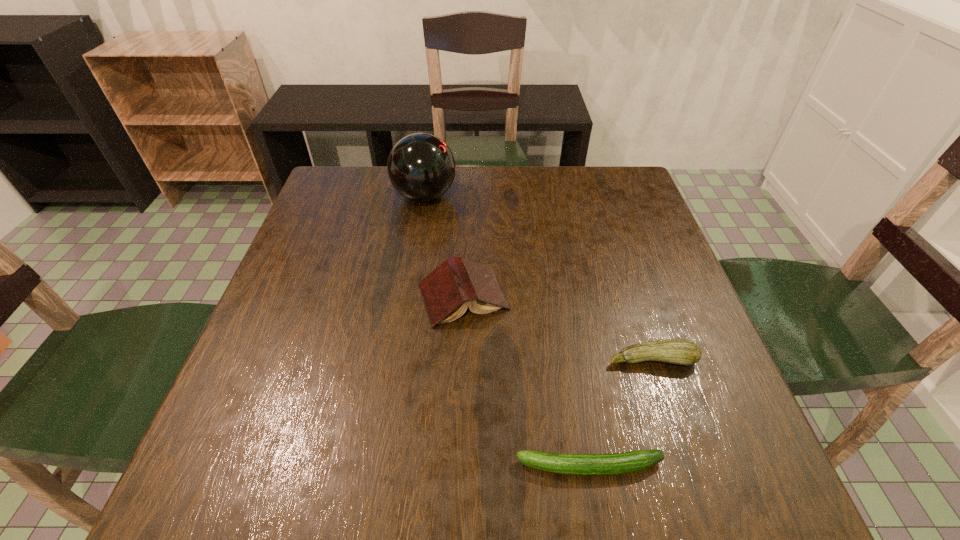
Where is `vacant space located at the stem end of the taller zucchini`? vacant space located at the stem end of the taller zucchini is located at coordinates (670, 414).

Where is `vacant space located 0.110m on the front-facing side of the nearest object`? The height and width of the screenshot is (540, 960). vacant space located 0.110m on the front-facing side of the nearest object is located at coordinates (447, 466).

Locate an element on the screen. free region located 0.250m on the front-facing side of the nearest object is located at coordinates (361, 466).

At what (x,y) coordinates should I click in order to perform the action: click on vacant space located on the front-facing side of the nearest object. Please return your answer as a coordinate pair (x, y). This screenshot has height=540, width=960. Looking at the image, I should click on (404, 466).

At what (x,y) coordinates should I click in order to perform the action: click on object located in the far edge section of the desktop. Please return your answer as a coordinate pair (x, y). Image resolution: width=960 pixels, height=540 pixels. Looking at the image, I should click on (421, 167).

Find the location of `object that is at the near edge`. object that is at the near edge is located at coordinates (634, 461).

You are a GUI agent. You are given a task and a screenshot of the screen. Output one action in this format:
    pyautogui.click(x=<x>, y=<y>)
    Task: Click on the object that is positioned at the near right corner
    The height and width of the screenshot is (540, 960).
    Given the screenshot: What is the action you would take?
    pyautogui.click(x=634, y=461)

This screenshot has height=540, width=960. What are the coordinates of `vacant region at the far edge of the desktop` in the screenshot? It's located at (534, 174).

Locate an element on the screen. blank space at the near edge of the desktop is located at coordinates (529, 470).

Find the location of a particular element. The width and height of the screenshot is (960, 540). vacant space at the left edge of the desktop is located at coordinates (295, 259).